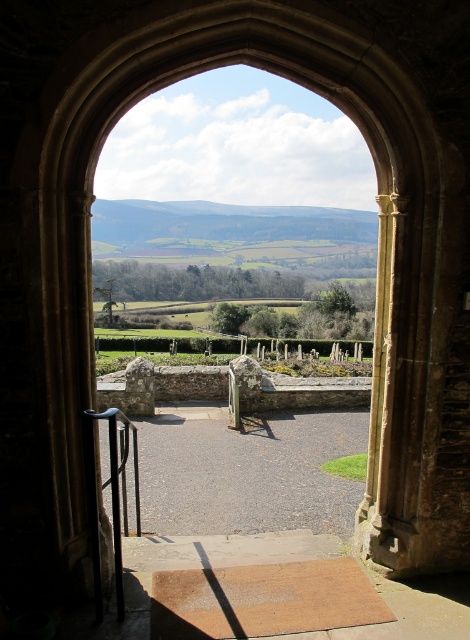
Who is lower down, gray gravel path at center or black metal rail at lower left?

gray gravel path at center is lower down.

Does gray gravel path at center appear over black metal rail at lower left?

No.

Locate an element on the screen. gray gravel path at center is located at coordinates (247, 470).